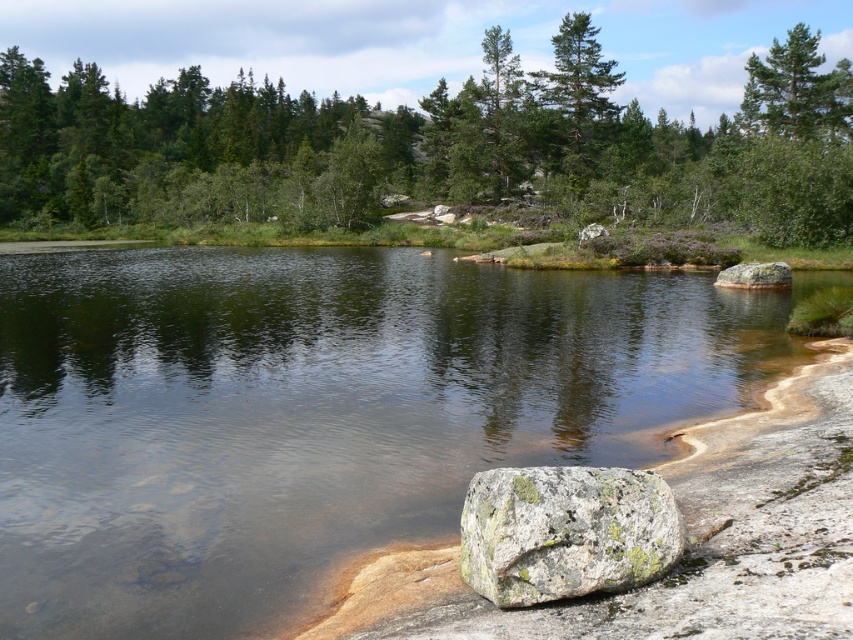
Question: Considering the real-world distances, which object is farthest from the clear water at center?

Choices:
 (A) green leafy trees at upper center
 (B) green textured pine tree at upper right

Answer: (A)

Question: Which object is positioned farthest from the speckled granite boulder at lower right?

Choices:
 (A) gray rough rock at right
 (B) green textured pine tree at upper right
 (C) green leafy trees at upper center

Answer: (C)

Question: Is green textured pine tree at upper right further to camera compared to gray rough rock at right?

Choices:
 (A) yes
 (B) no

Answer: (A)

Question: Does clear water at center appear on the right side of speckled granite boulder at lower right?

Choices:
 (A) no
 (B) yes

Answer: (A)

Question: Is clear water at center to the left of speckled granite boulder at lower right from the viewer's perspective?

Choices:
 (A) no
 (B) yes

Answer: (B)

Question: Which object is closer to the camera taking this photo?

Choices:
 (A) gray rough rock at right
 (B) green leafy trees at upper center

Answer: (A)